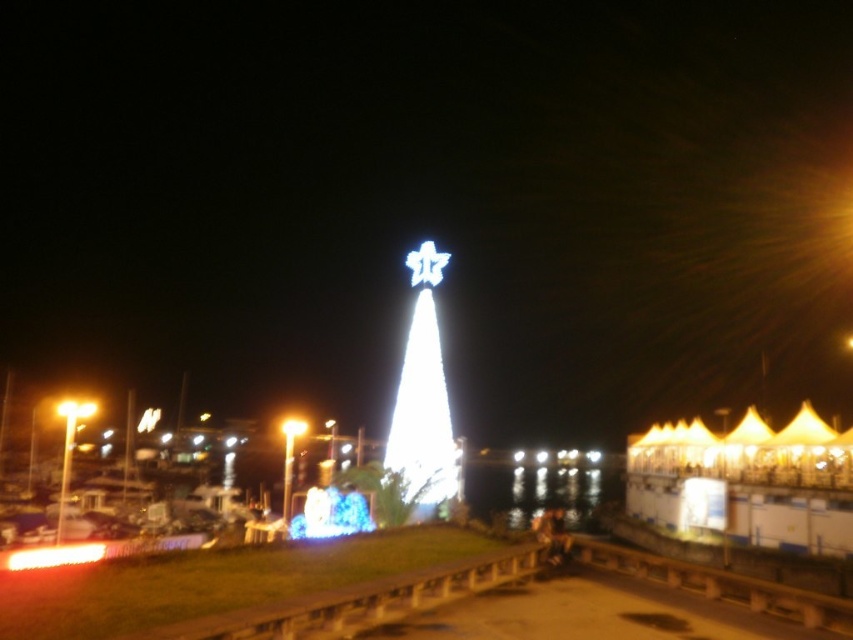
Who is positioned more to the right, white illuminated cone at center or matte yellow light at center?

white illuminated cone at center

Does white illuminated cone at center lie behind matte yellow light at center?

No, white illuminated cone at center is in front of matte yellow light at center.

Between point (390, 442) and point (283, 420), which one is positioned in front?

Positioned in front is point (390, 442).

Where is `white illuminated cone at center`? white illuminated cone at center is located at coordinates (422, 397).